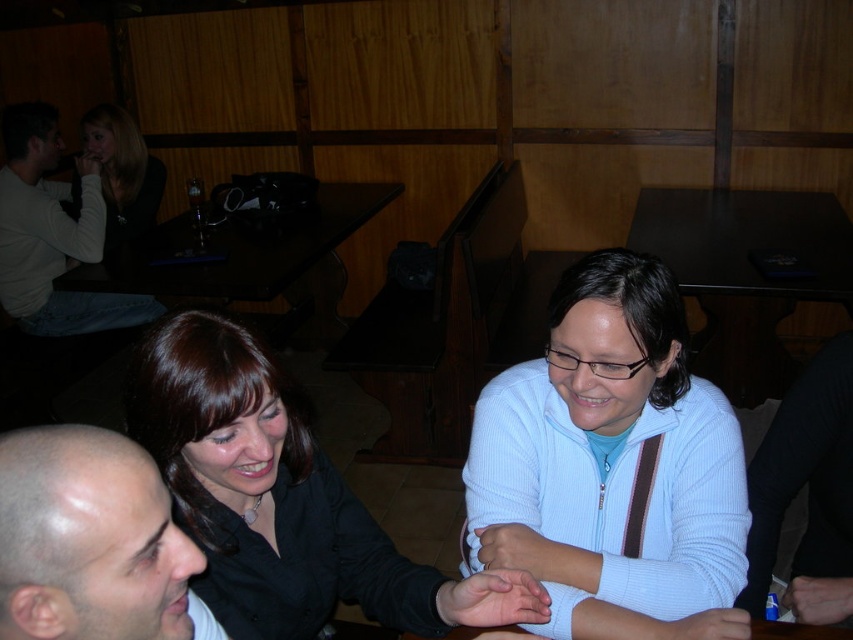
You are an interior designer assessing the layout of this indoor space. You notice the light blue denim jeans at upper left and the matte black hair at upper left. Which of these two items occupies more visual space in the image?

The light blue denim jeans at upper left occupies more visual space than the matte black hair at upper left, as it is described as bigger.